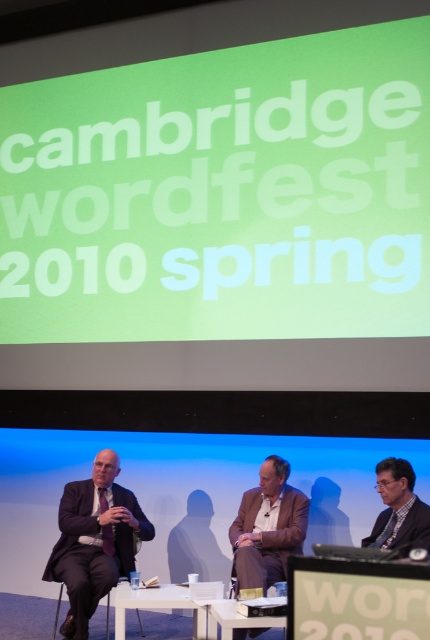
Question: Can you confirm if matte black suit at left is positioned above white plastic table at center?

Choices:
 (A) no
 (B) yes

Answer: (B)

Question: Among these objects, which one is nearest to the camera?

Choices:
 (A) white glossy table at lower center
 (B) dark gray suit at lower right
 (C) matte black suit at left

Answer: (A)

Question: Is brown leather jacket at center thinner than dark gray suit at lower right?

Choices:
 (A) yes
 (B) no

Answer: (B)

Question: Where is brown leather jacket at center located in relation to white plastic table at center in the image?

Choices:
 (A) left
 (B) right

Answer: (B)

Question: Which point is closer to the camera?

Choices:
 (A) dark gray suit at lower right
 (B) white plastic table at center
 (C) brown leather jacket at center
 (D) matte black suit at left

Answer: (A)

Question: Which object is closer to the camera taking this photo?

Choices:
 (A) dark gray suit at lower right
 (B) white glossy table at lower center
 (C) brown leather jacket at center
 (D) matte black suit at left

Answer: (B)